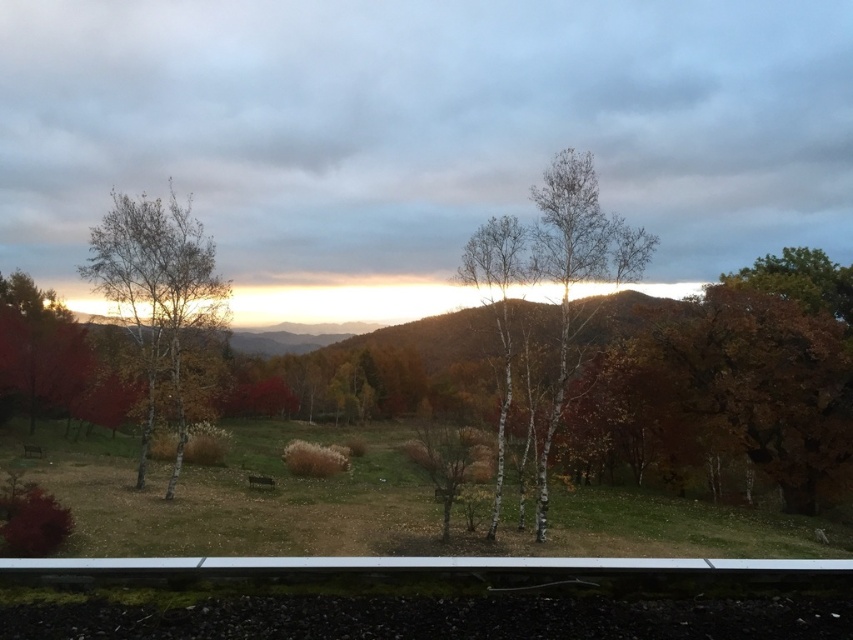
Question: Which object appears closest to the camera in this image?

Choices:
 (A) shiny red tree at left
 (B) smooth white birch at left
 (C) white bark trees at center

Answer: (C)

Question: Is shiny red tree at left to the right of white bark trees at center from the viewer's perspective?

Choices:
 (A) no
 (B) yes

Answer: (A)

Question: Which point appears closest to the camera in this image?

Choices:
 (A) (1, 392)
 (B) (184, 208)

Answer: (B)

Question: Among these objects, which one is farthest from the camera?

Choices:
 (A) smooth white birch at left
 (B) white bark trees at center
 (C) shiny red tree at left

Answer: (C)

Question: Considering the relative positions of shiny red tree at left and white bark trees at center in the image provided, where is shiny red tree at left located with respect to white bark trees at center?

Choices:
 (A) below
 (B) above

Answer: (B)

Question: Is smooth white birch at left smaller than white bark trees at center?

Choices:
 (A) no
 (B) yes

Answer: (A)